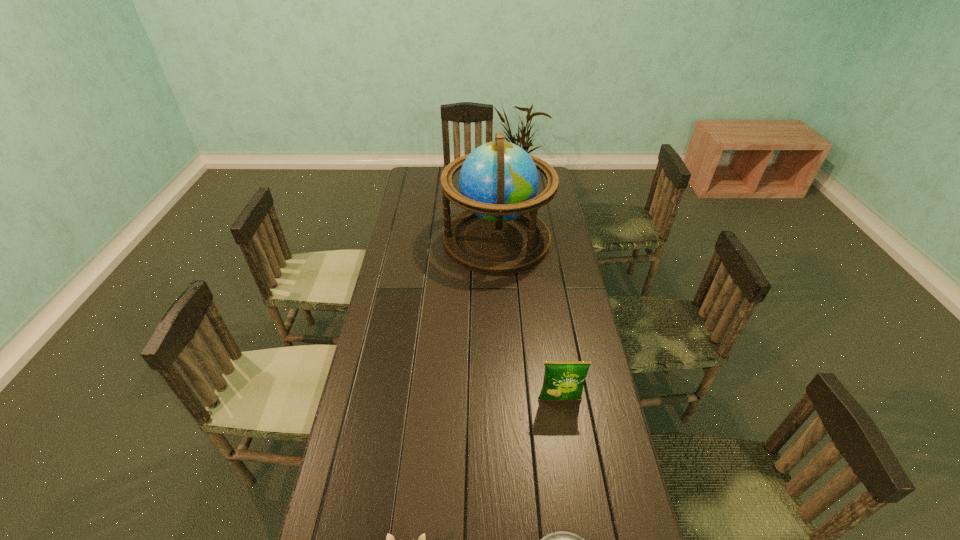
I want to click on vacant space at the far left corner, so click(422, 179).

Where is `vacant area that lies between the third nearest object and the globe`? The image size is (960, 540). vacant area that lies between the third nearest object and the globe is located at coordinates (528, 320).

Locate an element on the screen. vacant space in between the second tallest object and the tallest object is located at coordinates (528, 320).

Where is `free area in between the third nearest object and the farthest object`? free area in between the third nearest object and the farthest object is located at coordinates (528, 320).

Find the location of a particular element. The height and width of the screenshot is (540, 960). the second closest object to the tallest object is located at coordinates (561, 539).

Identify which object is the second nearest to the third shortest object. Please provide its 2D coordinates. Your answer should be formatted as a tuple, i.e. [(x, y)], where the tuple contains the x and y coordinates of a point satisfying the conditions above.

[(390, 539)]